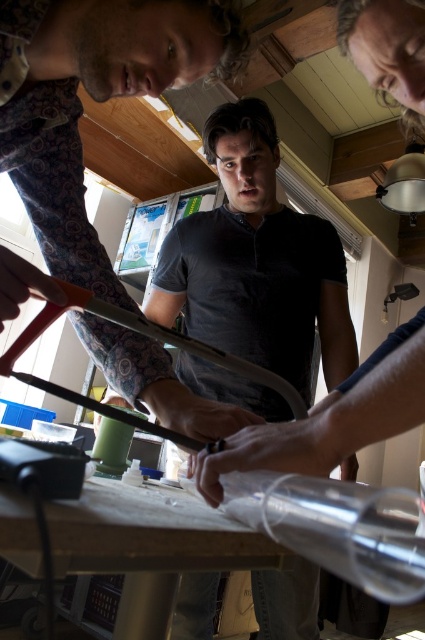
Question: Is wooden table at center further to the viewer compared to orange plastic ruler at center?

Choices:
 (A) yes
 (B) no

Answer: (B)

Question: Is wooden table at center above orange plastic ruler at center?

Choices:
 (A) yes
 (B) no

Answer: (B)

Question: Which point is closer to the camera taking this photo?

Choices:
 (A) (286, 397)
 (B) (20, 540)

Answer: (B)

Question: Can you confirm if wooden table at center is thinner than orange plastic ruler at center?

Choices:
 (A) no
 (B) yes

Answer: (B)

Question: Among these objects, which one is farthest from the camera?

Choices:
 (A) wooden table at center
 (B) orange plastic ruler at center

Answer: (B)

Question: Which point is farther to the camera?

Choices:
 (A) wooden table at center
 (B) orange plastic ruler at center

Answer: (B)